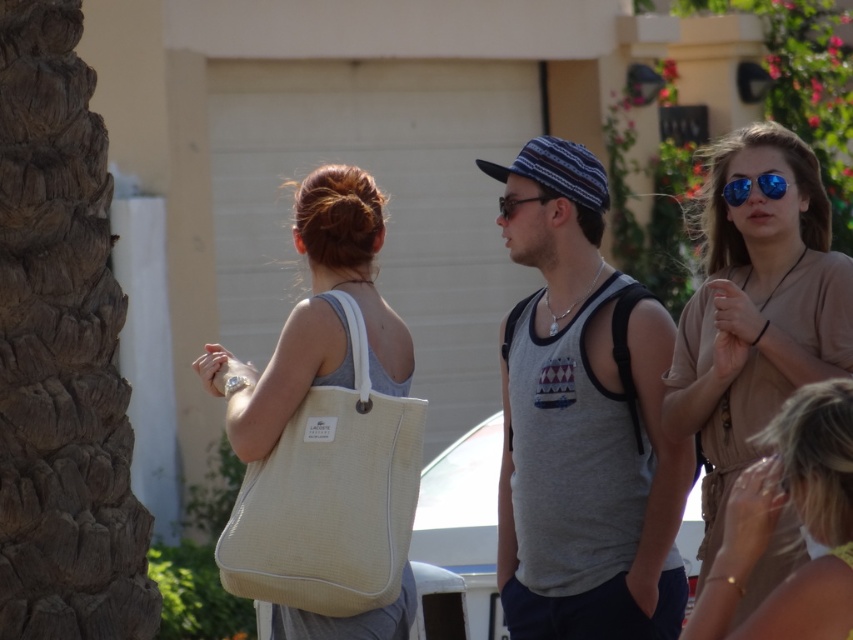
Question: Among these points, which one is nearest to the camera?

Choices:
 (A) (776, 589)
 (B) (720, 493)
 (C) (582, 582)

Answer: (A)

Question: Which object is closer to the camera taking this photo?

Choices:
 (A) gray cotton tank top at center
 (B) beige fabric dress at lower right
 (C) clear plastic goggles at center
 (D) matte brown dress at center

Answer: (B)

Question: Does gray cotton tank top at center lie behind blue reflective sunglasses at upper right?

Choices:
 (A) no
 (B) yes

Answer: (B)

Question: Which of the following is the farthest from the observer?

Choices:
 (A) beige fabric dress at lower right
 (B) blue reflective sunglasses at upper right
 (C) clear plastic goggles at center

Answer: (C)

Question: Is beige canvas tote at center in front of blue reflective sunglasses at upper right?

Choices:
 (A) yes
 (B) no

Answer: (A)

Question: Can you confirm if beige fabric dress at lower right is smaller than blue reflective sunglasses at upper right?

Choices:
 (A) no
 (B) yes

Answer: (A)